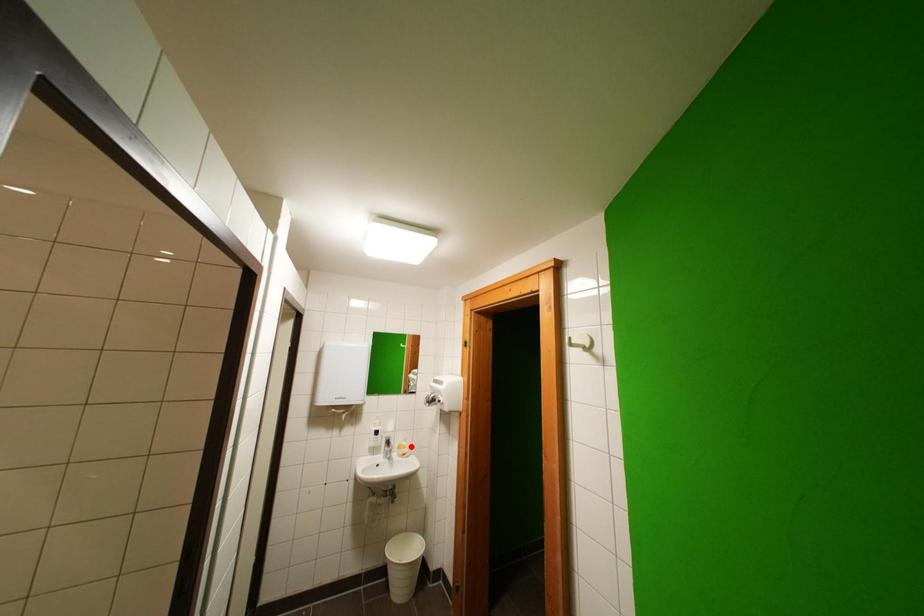
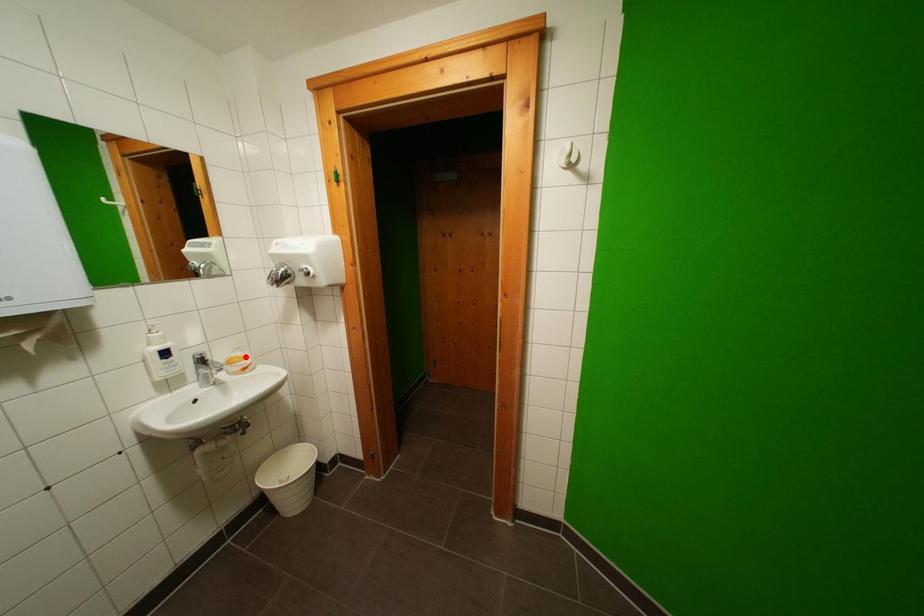
I am providing you with two images of the same scene from different viewpoints. A red point is marked on the first image and another point is marked on the second image. Is the red point in image1 aligned with the point shown in image2?

Yes